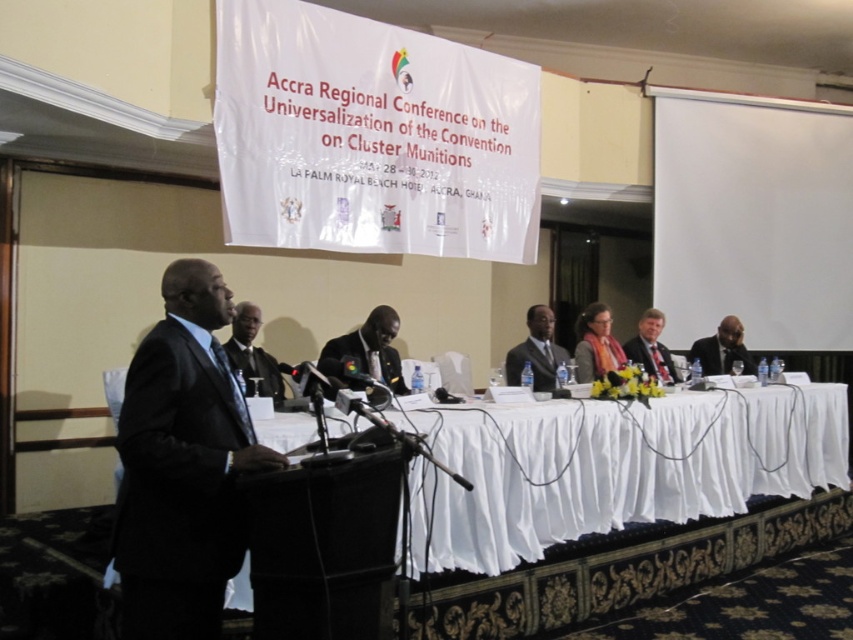
Who is shorter, dark gray matte suit at center or black matte suit at right?

Standing shorter between the two is black matte suit at right.

The image size is (853, 640). Describe the element at coordinates (360, 362) in the screenshot. I see `dark gray matte suit at center` at that location.

Is point (334, 378) in front of point (706, 355)?

Yes, point (334, 378) is closer to viewer.

Locate an element on the screen. The image size is (853, 640). dark gray matte suit at center is located at coordinates (360, 362).

Is point (198, 496) closer to camera compared to point (647, 342)?

Yes.

This screenshot has width=853, height=640. What are the coordinates of `black suit at left` in the screenshot? It's located at (183, 465).

Between point (183, 333) and point (630, 348), which one is positioned in front?

Point (183, 333) is in front.

At what (x,y) coordinates should I click in order to perform the action: click on black suit at left. Please return your answer as a coordinate pair (x, y). The width and height of the screenshot is (853, 640). Looking at the image, I should click on click(x=183, y=465).

Does black matte suit at center appear on the left side of dark gray suit at right?

Indeed, black matte suit at center is positioned on the left side of dark gray suit at right.

Can you confirm if black matte suit at center is smaller than dark gray suit at right?

No, black matte suit at center is not smaller than dark gray suit at right.

Locate an element on the screen. This screenshot has height=640, width=853. black matte suit at center is located at coordinates (254, 369).

Find the location of a particular element. Image resolution: width=853 pixels, height=640 pixels. black matte suit at center is located at coordinates (254, 369).